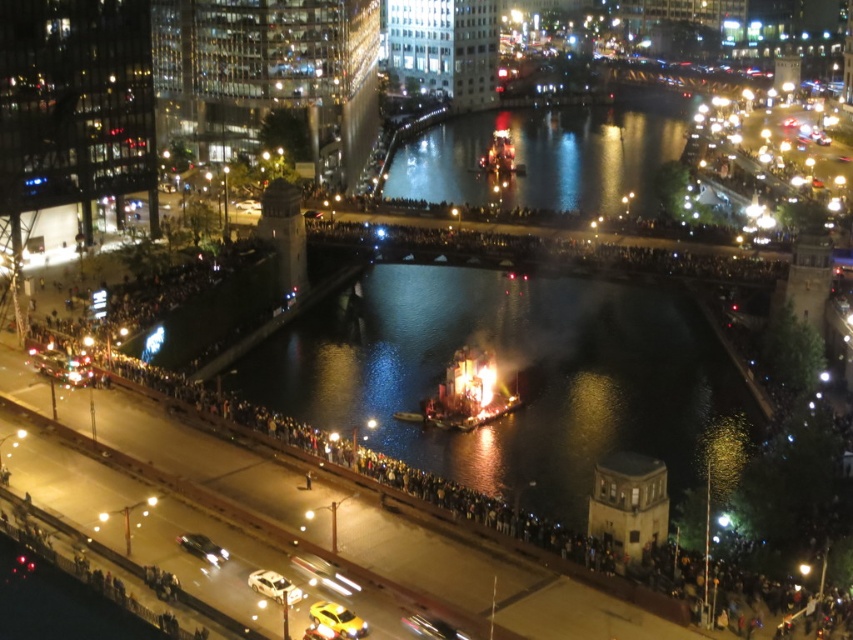
You are a photographer positioned on the riverbank and want to capture the shiny metallic structure at center in your shot. However, the dark reflective water at center is blocking your view. Can you adjust your position to see the structure without the water obstructing the view?

The dark reflective water at center is closer to the viewer than the shiny metallic structure at center. By moving your position to a higher elevation or angling your camera upwards, you can position yourself so that the structure is visible above the water, avoiding obstruction.